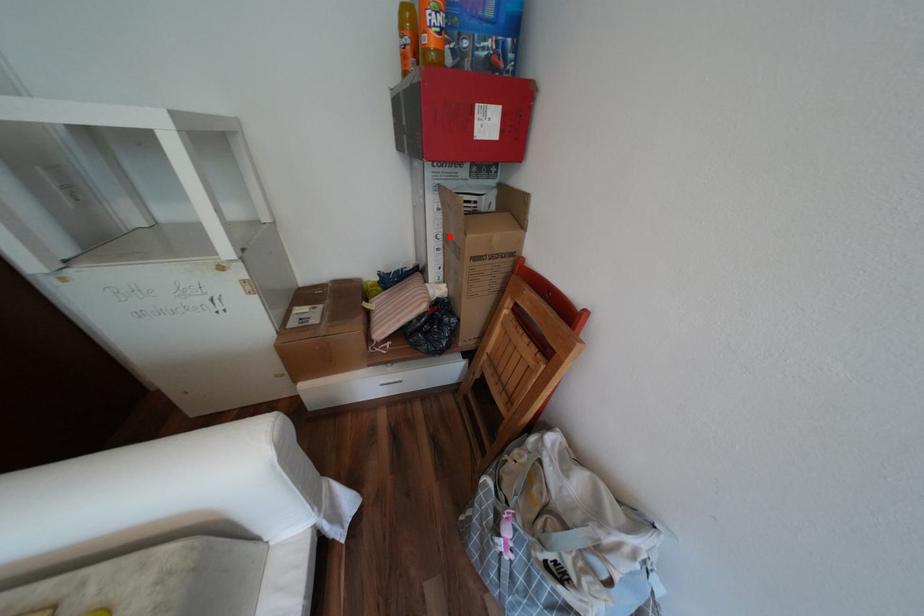
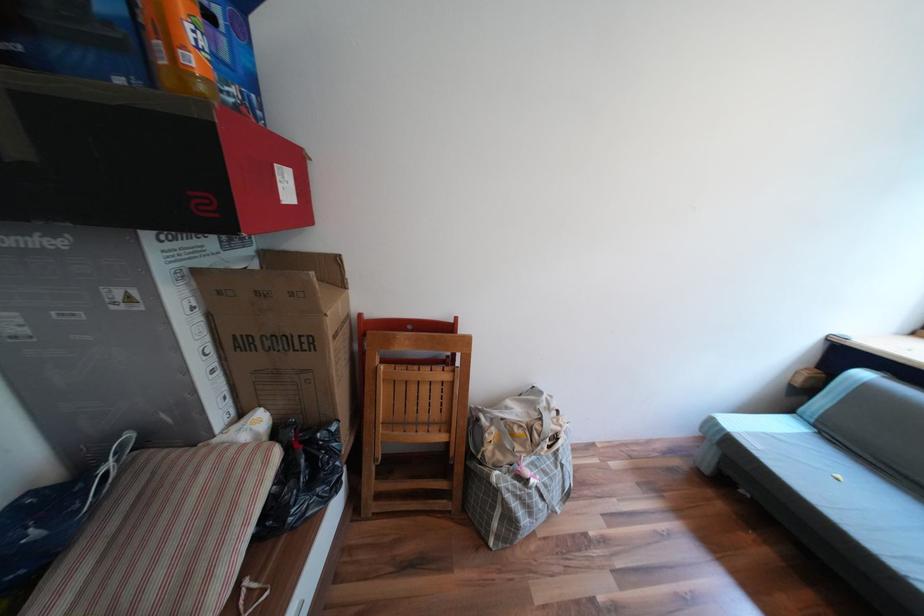
Question: I am providing you with two images of the same scene from different viewpoints. A red point is marked on the first image. At the location where the point appears in image 1, is it still visible in image 2?

Choices:
 (A) Yes
 (B) No

Answer: (A)